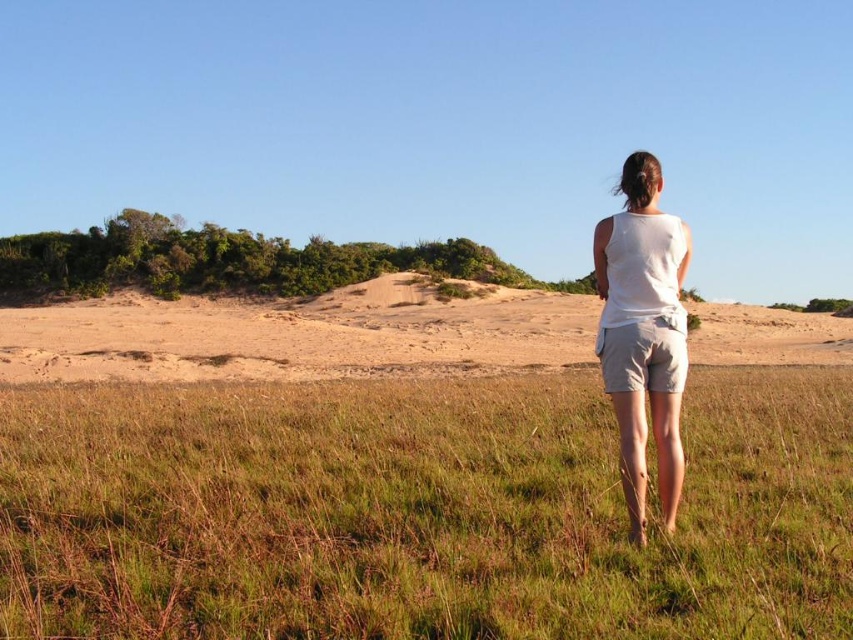
You are standing in the grassy area and want to walk towards the sandy dune. The path has two points marked as point (x=184, y=636) and point (x=633, y=337). Which point is closer to you when you start walking?

Point (x=184, y=636) is closer to the camera than point (x=633, y=337), so the point closer to you when you start walking is point (x=184, y=636).

You are a hiker who needs to cross the sandy terrain to reach the dunes. You notice the brown dry grass at center and the white cotton shorts at center in your path. How far apart are these two landmarks?

The brown dry grass at center is 4.56 meters from the white cotton shorts at center, so the distance between them is 4.56 meters.

You are planning to take a photograph of the person wearing the white cotton tank top at center in the serene outdoor scene. To ensure the subject is well lit, where should you position the light source relative to the person?

The white cotton tank top at center is located at point (643, 332). To ensure proper lighting, position the light source in front of the person to illuminate the front of the white cotton tank top at center effectively.